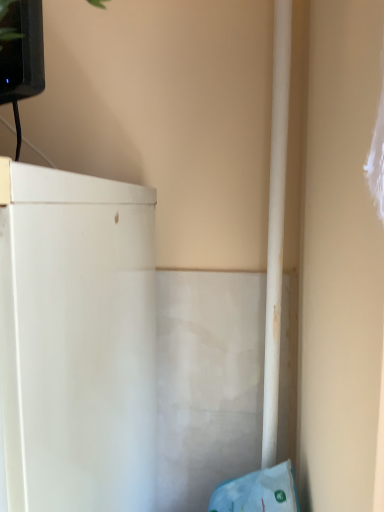
Question: Should I look upward or downward to see white smooth pipe at right?

Choices:
 (A) down
 (B) up

Answer: (B)